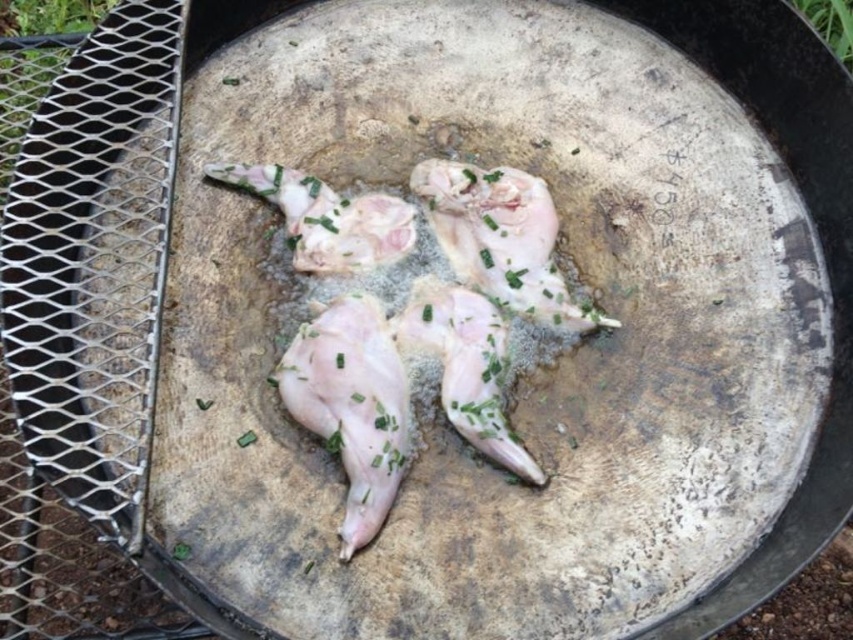
Is pink raw chicken at center smaller than pale pink raw chicken at center?

No, pink raw chicken at center is not smaller than pale pink raw chicken at center.

Can you confirm if pink raw chicken at center is positioned to the right of pale pink raw chicken at center?

Yes, pink raw chicken at center is to the right of pale pink raw chicken at center.

Which is behind, point (367, 460) or point (282, 356)?

The point (282, 356) is more distant.

Where is `pink raw chicken at center`? Image resolution: width=853 pixels, height=640 pixels. pink raw chicken at center is located at coordinates (433, 337).